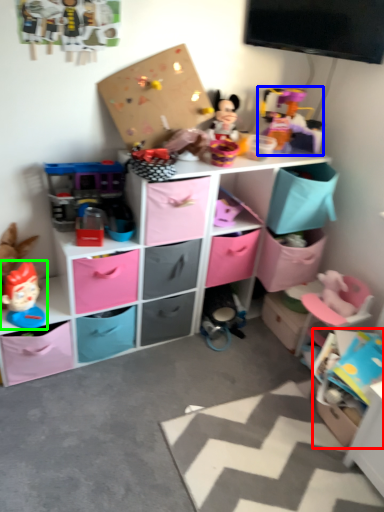
Question: Which object is positioned farthest from storage box (highlighted by a red box)? Select from toy (highlighted by a blue box) and toy (highlighted by a green box).

Choices:
 (A) toy
 (B) toy

Answer: (B)